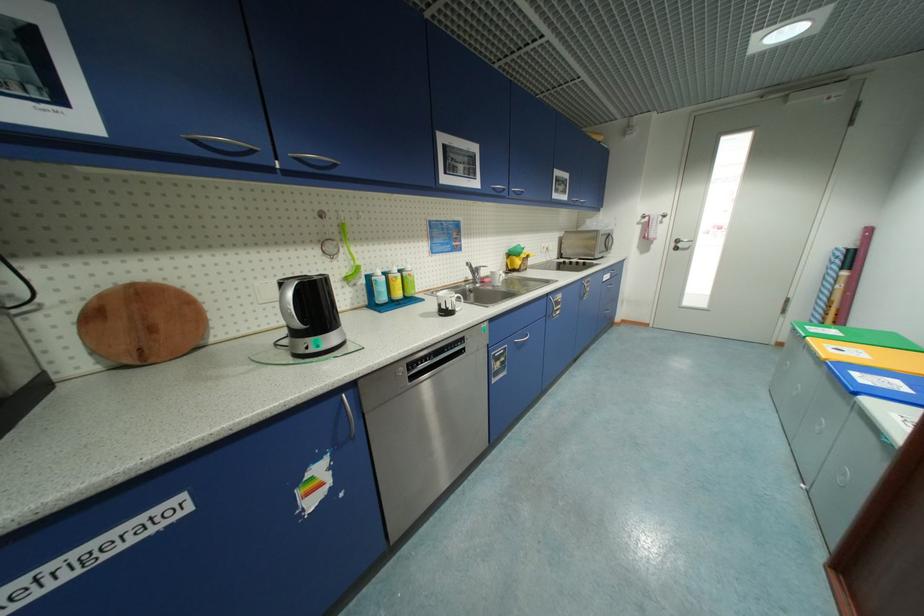
This screenshot has width=924, height=616. I want to click on black electric kettle handle, so click(x=289, y=302).